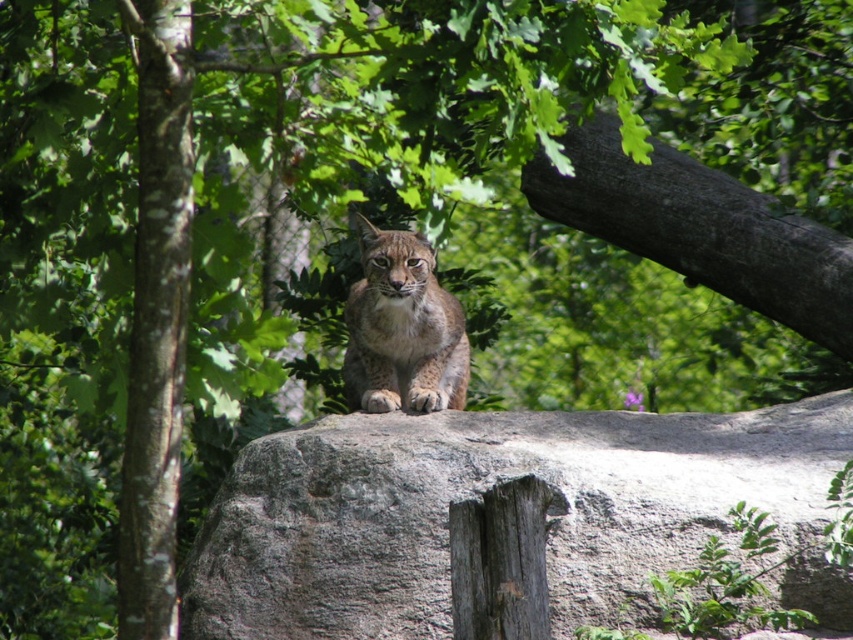
Question: Can you confirm if white speckled bark at left is positioned above spotted fur cat at center?

Choices:
 (A) no
 (B) yes

Answer: (B)

Question: Can you confirm if gray rough boulder at center is thinner than spotted fur cat at center?

Choices:
 (A) no
 (B) yes

Answer: (A)

Question: Which is nearer to the spotted fur cat at center?

Choices:
 (A) dark brown rough tree trunk at upper right
 (B) gray rough boulder at center

Answer: (B)

Question: Which of the following is the farthest from the observer?

Choices:
 (A) dark brown rough tree trunk at upper right
 (B) spotted fur cat at center

Answer: (A)

Question: Does gray rough boulder at center lie in front of white speckled bark at left?

Choices:
 (A) no
 (B) yes

Answer: (A)

Question: Which object is positioned farthest from the white speckled bark at left?

Choices:
 (A) dark brown rough tree trunk at upper right
 (B) spotted fur cat at center
 (C) gray rough boulder at center

Answer: (A)